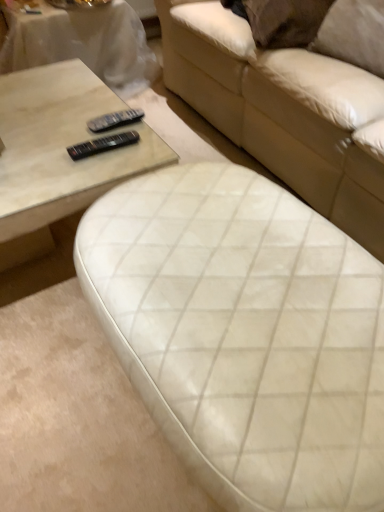
Question: Is matte glass coffee table at center far from matte white coffee table at upper left?

Choices:
 (A) no
 (B) yes

Answer: (A)

Question: Considering the relative sizes of matte glass coffee table at center and matte white coffee table at upper left in the image provided, is matte glass coffee table at center thinner than matte white coffee table at upper left?

Choices:
 (A) yes
 (B) no

Answer: (B)

Question: Can we say matte glass coffee table at center lies outside matte white coffee table at upper left?

Choices:
 (A) no
 (B) yes

Answer: (B)

Question: Is matte white coffee table at upper left inside matte glass coffee table at center?

Choices:
 (A) yes
 (B) no

Answer: (B)

Question: Is matte glass coffee table at center aimed at matte white coffee table at upper left?

Choices:
 (A) yes
 (B) no

Answer: (B)

Question: Is point (165, 159) closer or farther from the camera than point (269, 381)?

Choices:
 (A) closer
 (B) farther

Answer: (B)

Question: Choose the correct answer: Is matte glass coffee table at center inside white quilted leather ottoman at center, the 1th studio couch in the bottom-to-top sequence, or outside it?

Choices:
 (A) outside
 (B) inside

Answer: (A)

Question: Looking at their shapes, would you say matte glass coffee table at center is wider or thinner than white quilted leather ottoman at center, acting as the second studio couch starting from the top?

Choices:
 (A) thin
 (B) wide

Answer: (B)

Question: Would you say matte glass coffee table at center is to the left or to the right of white quilted leather ottoman at center, acting as the second studio couch starting from the top, in the picture?

Choices:
 (A) left
 (B) right

Answer: (A)

Question: Is black plastic remote at upper center, which is the second remote in bottom-to-top order, bigger or smaller than black plastic remote at center, which is counted as the 1th remote, starting from the bottom?

Choices:
 (A) small
 (B) big

Answer: (B)

Question: Is black plastic remote at upper center, acting as the 1th remote starting from the top, situated inside black plastic remote at center, the second remote positioned from the top, or outside?

Choices:
 (A) inside
 (B) outside

Answer: (B)

Question: Considering the positions of point (109, 122) and point (122, 135), is point (109, 122) closer or farther from the camera than point (122, 135)?

Choices:
 (A) closer
 (B) farther

Answer: (B)

Question: From the image's perspective, is black plastic remote at upper center, which is the second remote in bottom-to-top order, positioned above or below black plastic remote at center, the second remote positioned from the top?

Choices:
 (A) below
 (B) above

Answer: (B)

Question: From the image's perspective, relative to white quilted leather ottoman at center, the 1th studio couch in the bottom-to-top sequence, is black plastic remote at upper center, which is the second remote in bottom-to-top order, above or below?

Choices:
 (A) above
 (B) below

Answer: (A)

Question: Considering the positions of point (107, 130) and point (148, 266), is point (107, 130) closer or farther from the camera than point (148, 266)?

Choices:
 (A) closer
 (B) farther

Answer: (B)